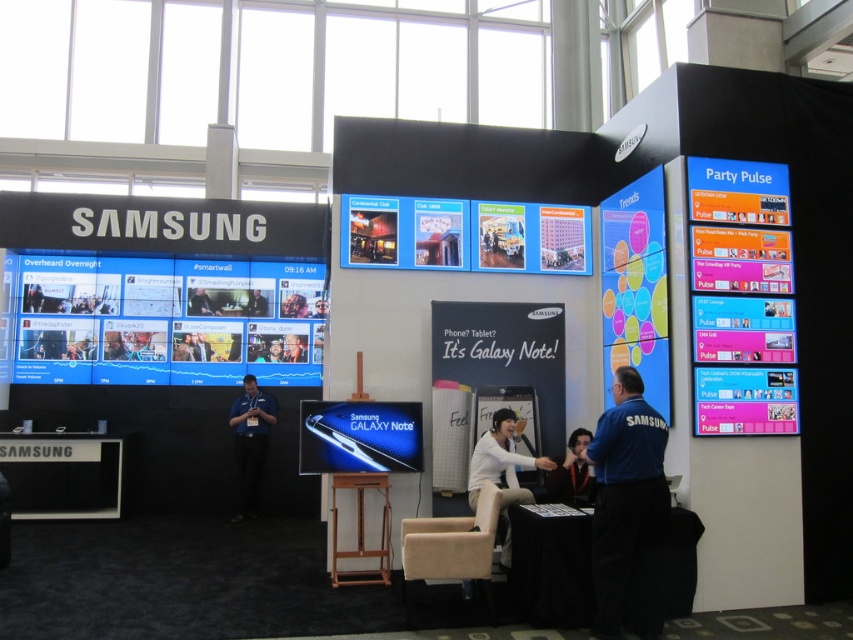
Does blue fabric shirt at right have a greater width compared to beige fabric chair at lower center?

Incorrect, blue fabric shirt at right's width does not surpass beige fabric chair at lower center's.

Between point (653, 408) and point (479, 506), which one is positioned behind?

Point (479, 506)

Image resolution: width=853 pixels, height=640 pixels. What are the coordinates of `blue fabric shirt at right` in the screenshot? It's located at (628, 513).

Is white fabric chair at center below dark blue fabric shirt at center?

Yes.

Does point (508, 540) lie in front of point (573, 432)?

Yes, point (508, 540) is in front of point (573, 432).

Is point (491, 422) closer to camera compared to point (563, 467)?

That is False.

Where is `white fabric chair at center`? white fabric chair at center is located at coordinates (502, 470).

Does point (438, 538) come behind point (363, 483)?

That is False.

Find the location of a particular element. beige fabric chair at lower center is located at coordinates (451, 547).